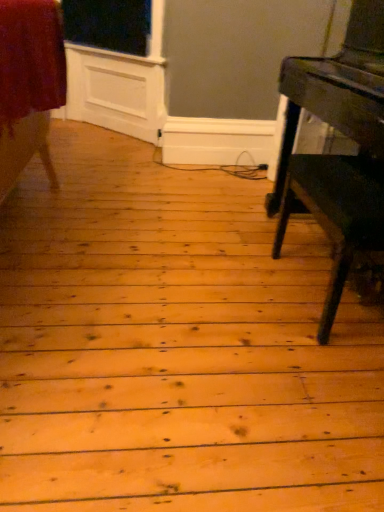
Question: In terms of size, does shiny dark wood table at right appear bigger or smaller than velvet red skirt at left?

Choices:
 (A) big
 (B) small

Answer: (A)

Question: Is point coord(332,231) closer or farther from the camera than point coord(33,30)?

Choices:
 (A) farther
 (B) closer

Answer: (A)

Question: Would you say shiny dark wood table at right is inside or outside velvet red skirt at left?

Choices:
 (A) inside
 (B) outside

Answer: (B)

Question: Is velvet red skirt at left situated inside shiny dark wood table at right or outside?

Choices:
 (A) outside
 (B) inside

Answer: (A)

Question: In the image, is velvet red skirt at left on the left side or the right side of shiny dark wood table at right?

Choices:
 (A) right
 (B) left

Answer: (B)

Question: Is velvet red skirt at left taller or shorter than shiny dark wood table at right?

Choices:
 (A) short
 (B) tall

Answer: (A)

Question: Looking at the image, does velvet red skirt at left seem bigger or smaller compared to shiny dark wood table at right?

Choices:
 (A) small
 (B) big

Answer: (A)